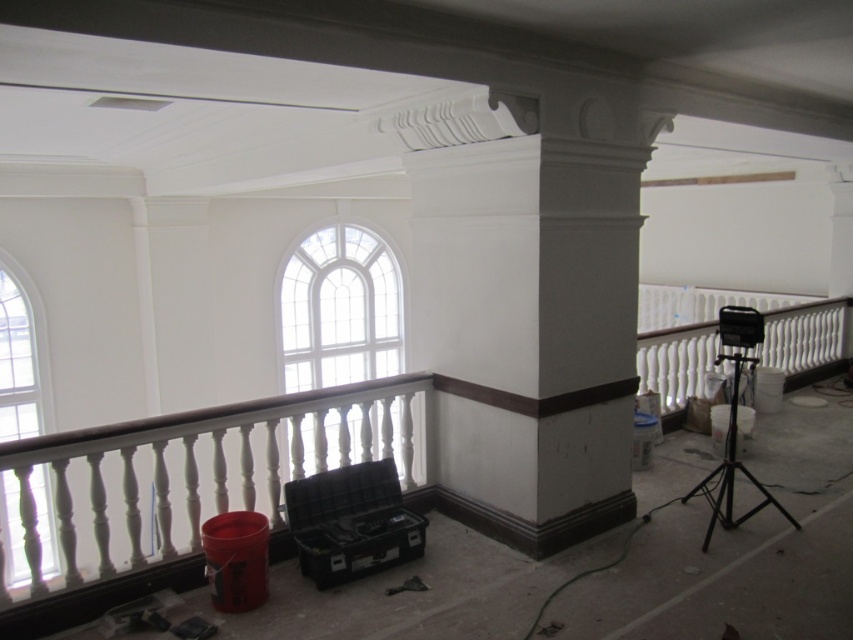
Based on the photo, can you confirm if white glass window at center is positioned to the right of clear glass window at left?

Indeed, white glass window at center is positioned on the right side of clear glass window at left.

Can you confirm if white glass window at center is positioned below clear glass window at left?

Yes.

The height and width of the screenshot is (640, 853). I want to click on white glass window at center, so click(339, 308).

Consider the image. Between clear glass window at left and black metal tripod at right, which one appears on the left side from the viewer's perspective?

From the viewer's perspective, clear glass window at left appears more on the left side.

Who is taller, clear glass window at left or black metal tripod at right?

With more height is black metal tripod at right.

This screenshot has height=640, width=853. In order to click on clear glass window at left in this screenshot , I will do `click(22, 355)`.

Which of these two, white glass window at center or black metal tripod at right, stands shorter?

With less height is black metal tripod at right.

Measure the distance between white glass window at center and camera.

A distance of 8.66 meters exists between white glass window at center and camera.

Is point (349, 454) farther from camera compared to point (740, 358)?

That is True.

The height and width of the screenshot is (640, 853). Identify the location of white glass window at center. (339, 308).